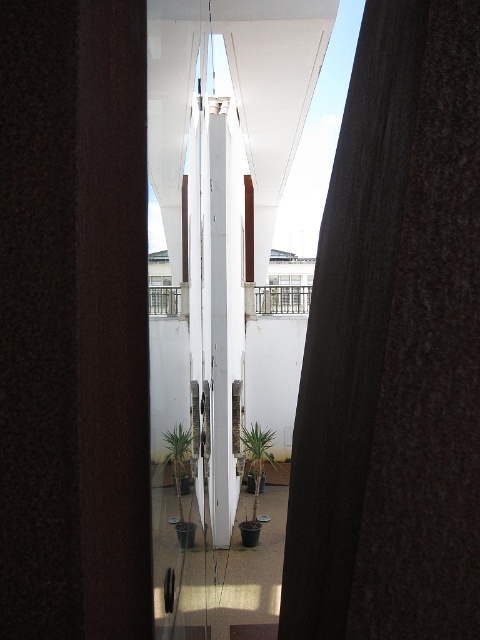
Question: Does metallic railing at center have a lesser width compared to white metal railing at center?

Choices:
 (A) no
 (B) yes

Answer: (A)

Question: Is green matte plant at center wider than white metal railing at center?

Choices:
 (A) no
 (B) yes

Answer: (B)

Question: Which object is closer to the camera taking this photo?

Choices:
 (A) white metal railing at center
 (B) green matte plant at center

Answer: (A)

Question: Is green matte potted plants at center smaller than white metal railing at center?

Choices:
 (A) no
 (B) yes

Answer: (A)

Question: Which of the following is the farthest from the observer?

Choices:
 (A) (x=179, y=292)
 (B) (x=254, y=451)
 (C) (x=180, y=496)

Answer: (B)

Question: Which object is positioned farthest from the green matte plant at center?

Choices:
 (A) green matte potted plants at center
 (B) green leafy plant at center
 (C) metallic railing at center

Answer: (C)